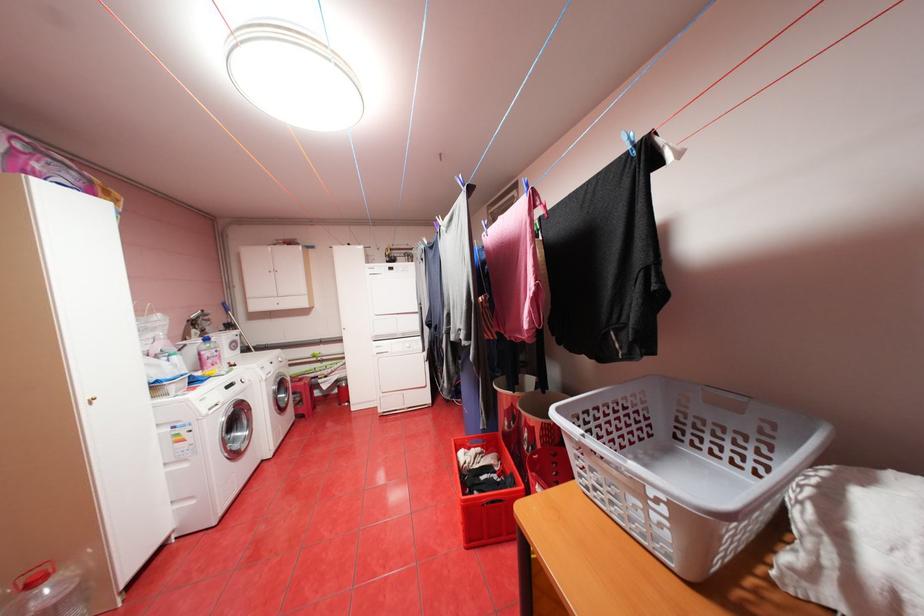
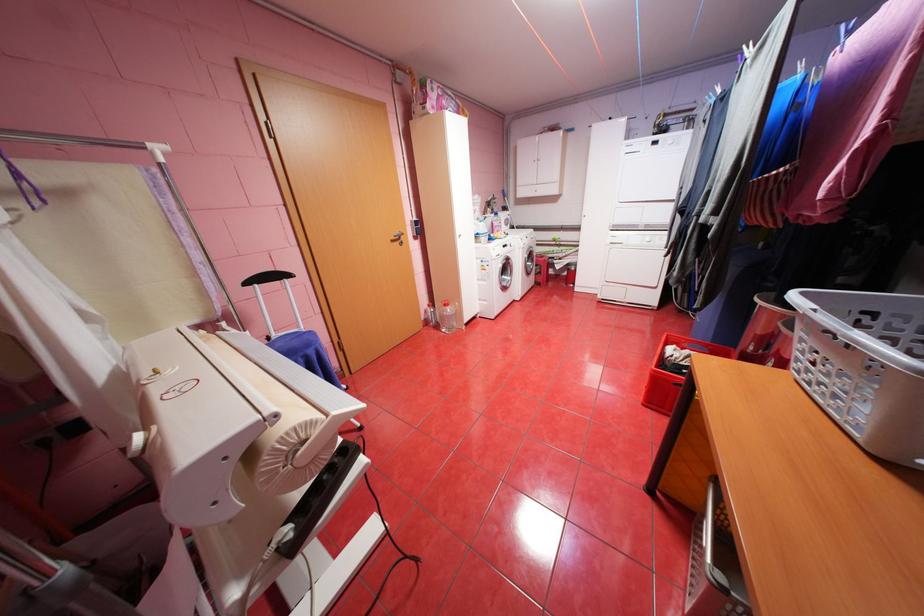
Based on the continuous images, in which direction is the camera rotating?

The camera's rotation is toward left-down.